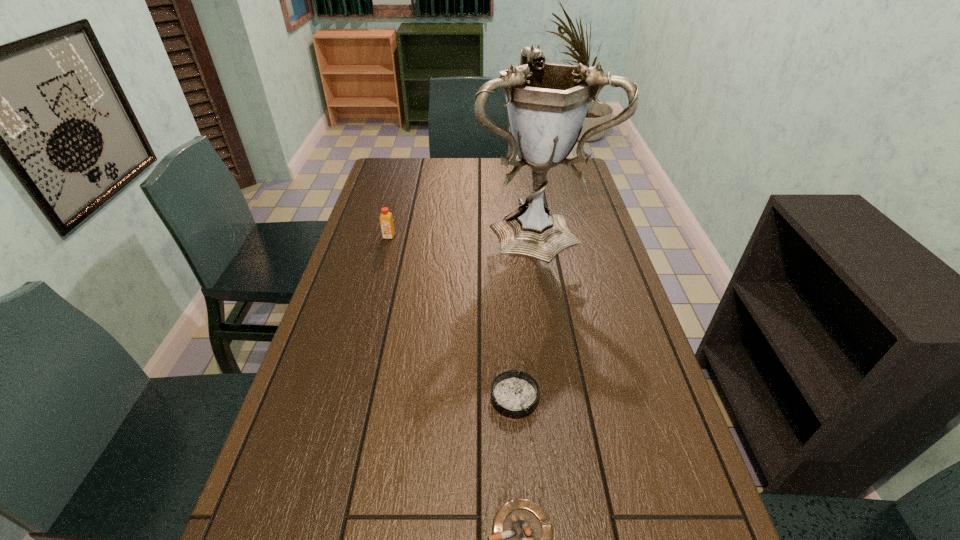
In the image, there is a desktop. Where is `vacant space at the right edge`? vacant space at the right edge is located at coordinates (659, 498).

The image size is (960, 540). What are the coordinates of `vacant space at the far left corner of the desktop` in the screenshot? It's located at (385, 179).

In order to click on vacant space at the far right corner of the desktop in this screenshot , I will do `click(583, 184)`.

The height and width of the screenshot is (540, 960). What are the coordinates of `blank region between the farther ashtray and the tallest object` in the screenshot? It's located at (525, 312).

Locate an element on the screen. The width and height of the screenshot is (960, 540). vacant area between the tallest object and the farther ashtray is located at coordinates (525, 312).

This screenshot has height=540, width=960. I want to click on empty location between the third shortest object and the trophy cup, so 463,232.

What are the coordinates of `free spot between the second tallest object and the tallest object` in the screenshot? It's located at (463, 232).

Locate an element on the screen. vacant space that is in between the tallest object and the orange juice is located at coordinates (463, 232).

Find the location of a particular element. This screenshot has width=960, height=540. vacant region between the third farthest object and the second tallest object is located at coordinates (452, 317).

Select which object appears as the third closest to the third shortest object. Please provide its 2D coordinates. Your answer should be formatted as a tuple, i.e. [(x, y)], where the tuple contains the x and y coordinates of a point satisfying the conditions above.

[(522, 535)]